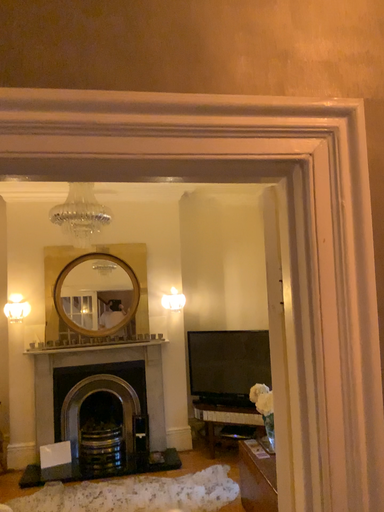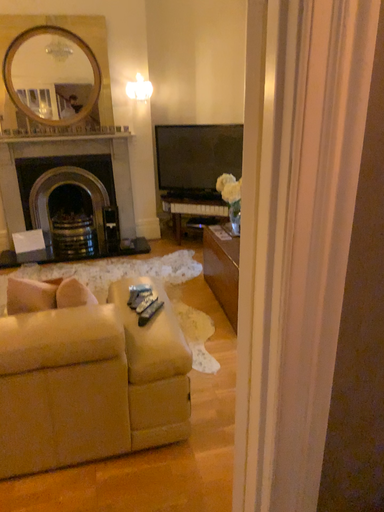
Question: How did the camera likely rotate when shooting the video?

Choices:
 (A) rotated downward
 (B) rotated upward

Answer: (A)